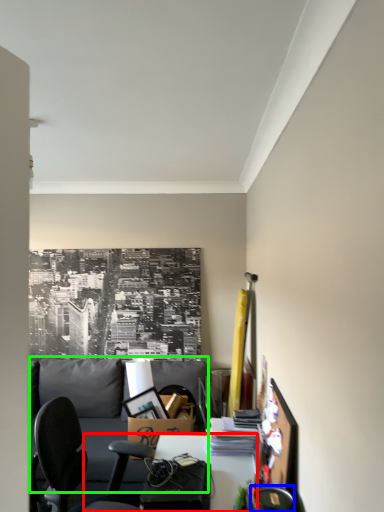
Question: Considering the real-world distances, which object is closest to desk (highlighted by a red box)? chair (highlighted by a blue box) or couch (highlighted by a green box).

Choices:
 (A) chair
 (B) couch

Answer: (A)